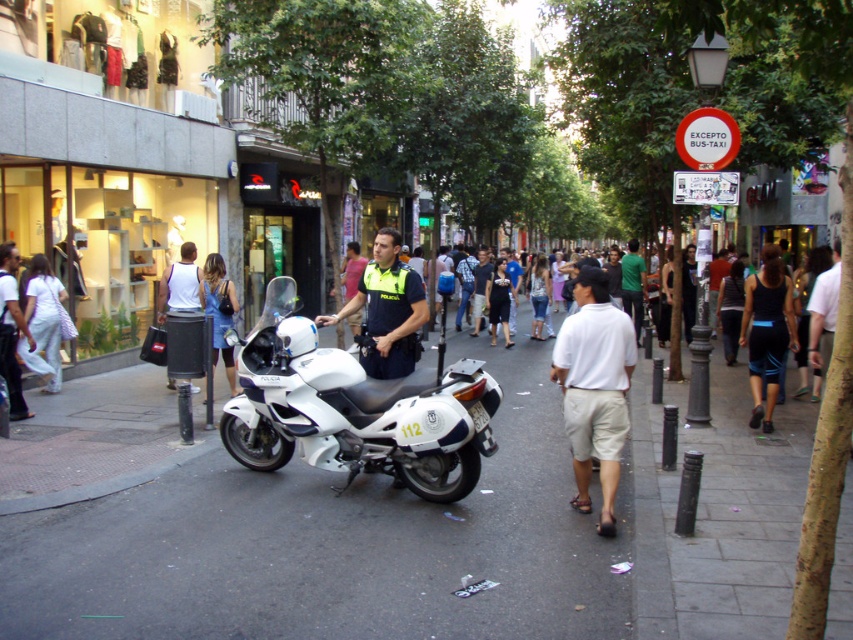
Between white cotton shirt at center and denim skirt at center, which one has more height?

Standing taller between the two is white cotton shirt at center.

Does white cotton shirt at center appear on the right side of denim skirt at center?

Indeed, white cotton shirt at center is positioned on the right side of denim skirt at center.

Is point (589, 305) farther from camera compared to point (215, 269)?

No.

You are a GUI agent. You are given a task and a screenshot of the screen. Output one action in this format:
    pyautogui.click(x=<x>, y=<y>)
    Task: Click on the white cotton shirt at center
    This screenshot has height=640, width=853.
    Given the screenshot: What is the action you would take?
    pyautogui.click(x=595, y=388)

Is point (627, 332) positioned behind point (640, 296)?

No, it is not.

Where is `white cotton shirt at center`? This screenshot has width=853, height=640. white cotton shirt at center is located at coordinates (595, 388).

Find the location of a particular element. Image resolution: width=853 pixels, height=640 pixels. white cotton shirt at center is located at coordinates (595, 388).

Is white asphalt at center shorter than denim skirt at center?

Indeed, white asphalt at center has a lesser height compared to denim skirt at center.

Is point (460, 572) more distant than point (210, 266)?

No, (460, 572) is closer to viewer.

In the scene shown: Who is more forward, (67, 611) or (213, 301)?

Point (67, 611) is more forward.

Where is `white asphalt at center`? white asphalt at center is located at coordinates (329, 547).